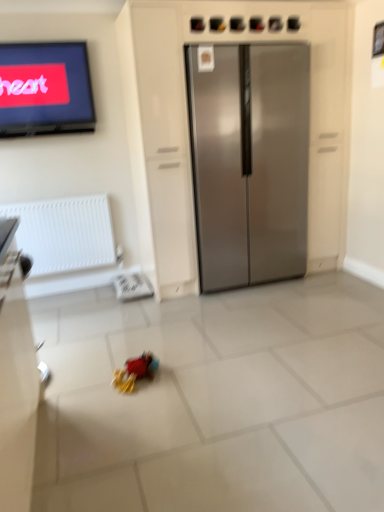
Question: Is white textured radiator at left outside of rubberized plastic toy at center?

Choices:
 (A) no
 (B) yes

Answer: (B)

Question: Is white textured radiator at left in front of rubberized plastic toy at center?

Choices:
 (A) yes
 (B) no

Answer: (B)

Question: Is rubberized plastic toy at center a part of white textured radiator at left?

Choices:
 (A) yes
 (B) no

Answer: (B)

Question: Is white textured radiator at left smaller than rubberized plastic toy at center?

Choices:
 (A) no
 (B) yes

Answer: (A)

Question: Is white textured radiator at left taller than rubberized plastic toy at center?

Choices:
 (A) yes
 (B) no

Answer: (A)

Question: Does white textured radiator at left have a lesser height compared to rubberized plastic toy at center?

Choices:
 (A) yes
 (B) no

Answer: (B)

Question: Is white textured radiator at left at the back of rubberized plastic toy at center?

Choices:
 (A) yes
 (B) no

Answer: (B)

Question: Considering the relative positions of rubberized plastic toy at center and white textured radiator at left in the image provided, is rubberized plastic toy at center to the left of white textured radiator at left from the viewer's perspective?

Choices:
 (A) no
 (B) yes

Answer: (A)

Question: Does rubberized plastic toy at center have a lesser width compared to white textured radiator at left?

Choices:
 (A) no
 (B) yes

Answer: (A)

Question: Can you confirm if rubberized plastic toy at center is positioned to the right of white textured radiator at left?

Choices:
 (A) yes
 (B) no

Answer: (A)

Question: Is rubberized plastic toy at center facing towards white textured radiator at left?

Choices:
 (A) no
 (B) yes

Answer: (A)

Question: From a real-world perspective, is rubberized plastic toy at center below white textured radiator at left?

Choices:
 (A) no
 (B) yes

Answer: (B)

Question: Is white textured radiator at left closer to the viewer compared to stainless steel refrigerator at center?

Choices:
 (A) yes
 (B) no

Answer: (B)